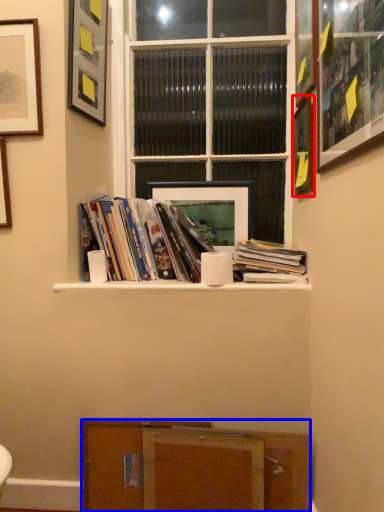
Question: Which of the following is the farthest to the observer, picture frame (highlighted by a red box) or cabinetry (highlighted by a blue box)?

Choices:
 (A) picture frame
 (B) cabinetry

Answer: (A)